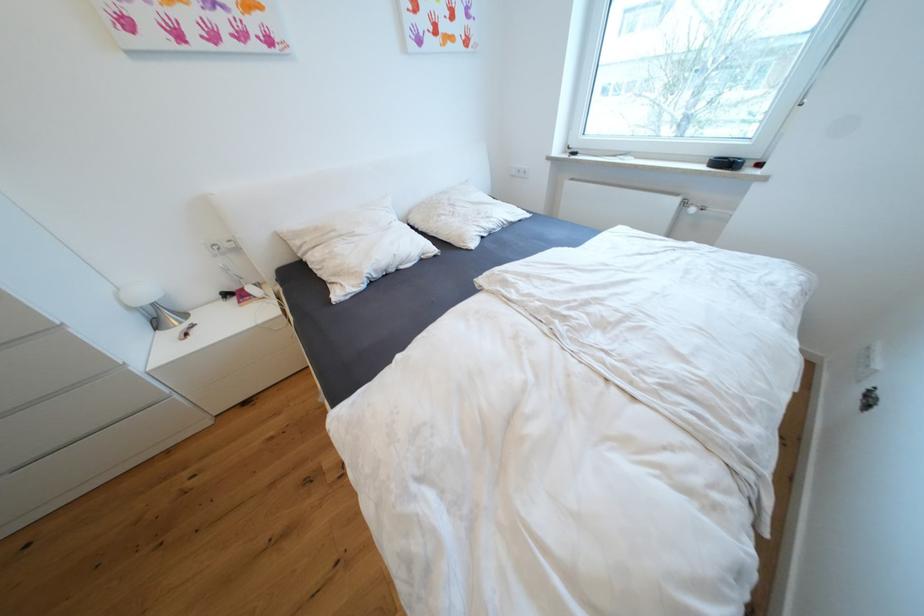
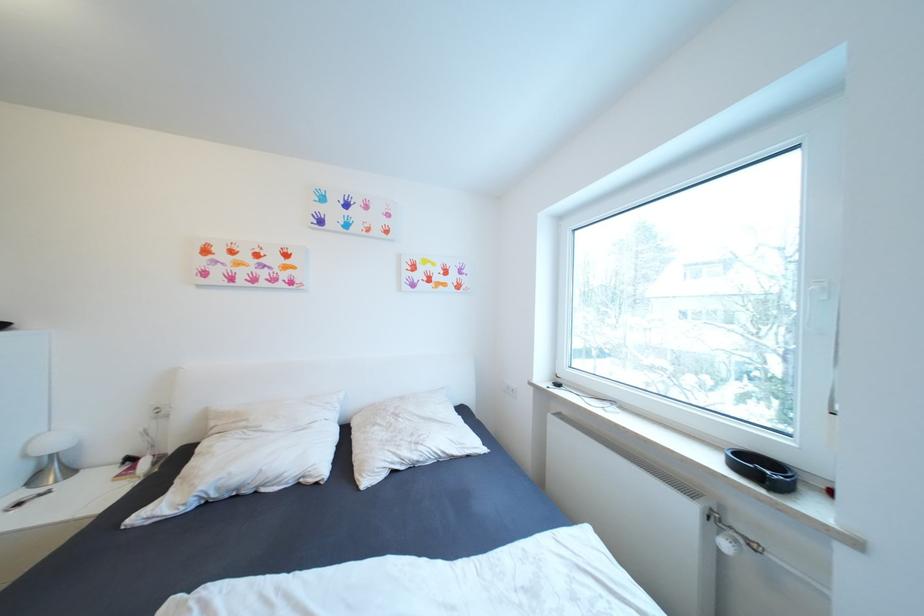
Find the pixel in the second image that matches [459,207] in the first image.

(405, 416)